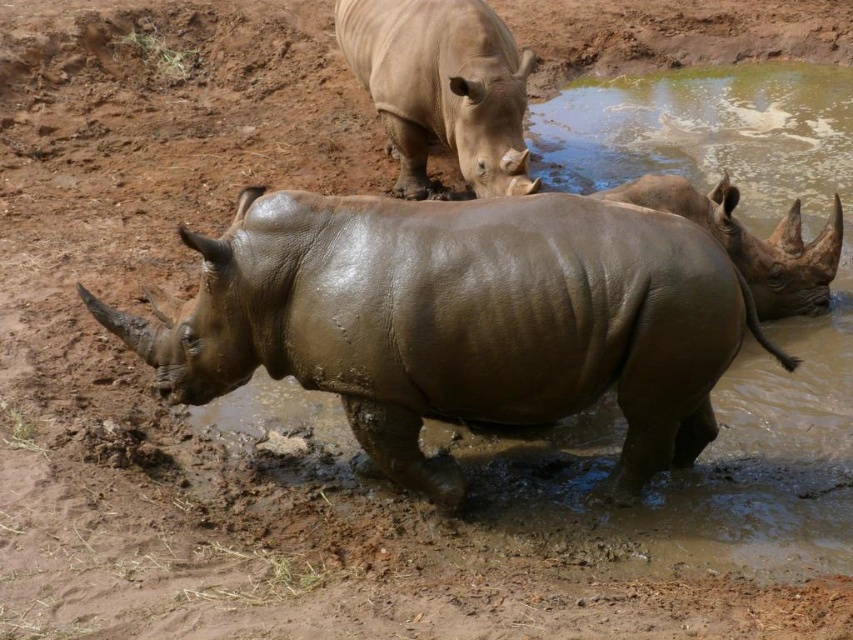
Question: Is smooth beige rhino at upper center to the right of matte brown rhinoceros at center from the viewer's perspective?

Choices:
 (A) no
 (B) yes

Answer: (A)

Question: Which is farther from the matte brown rhinoceros at center?

Choices:
 (A) muddy brown rhinoceros at center
 (B) smooth beige rhino at upper center

Answer: (A)

Question: In this image, where is smooth beige rhino at upper center located relative to matte brown rhinoceros at center?

Choices:
 (A) right
 (B) left

Answer: (B)

Question: Does muddy brown rhinoceros at center have a greater width compared to smooth beige rhino at upper center?

Choices:
 (A) yes
 (B) no

Answer: (A)

Question: Which object appears farthest from the camera in this image?

Choices:
 (A) muddy brown rhinoceros at center
 (B) smooth beige rhino at upper center
 (C) matte brown rhinoceros at center

Answer: (B)

Question: Which is nearer to the smooth beige rhino at upper center?

Choices:
 (A) muddy brown rhinoceros at center
 (B) matte brown rhinoceros at center

Answer: (B)